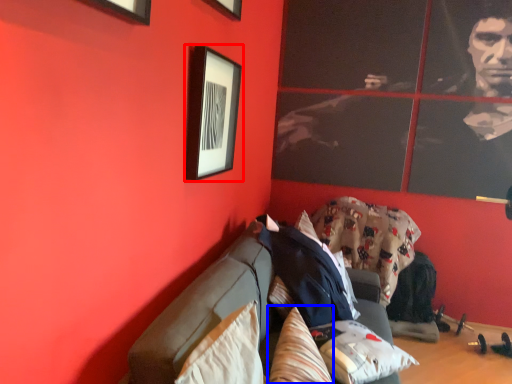
Question: Which object appears farthest to the camera in this image, picture frame (highlighted by a red box) or pillow (highlighted by a blue box)?

Choices:
 (A) picture frame
 (B) pillow

Answer: (A)